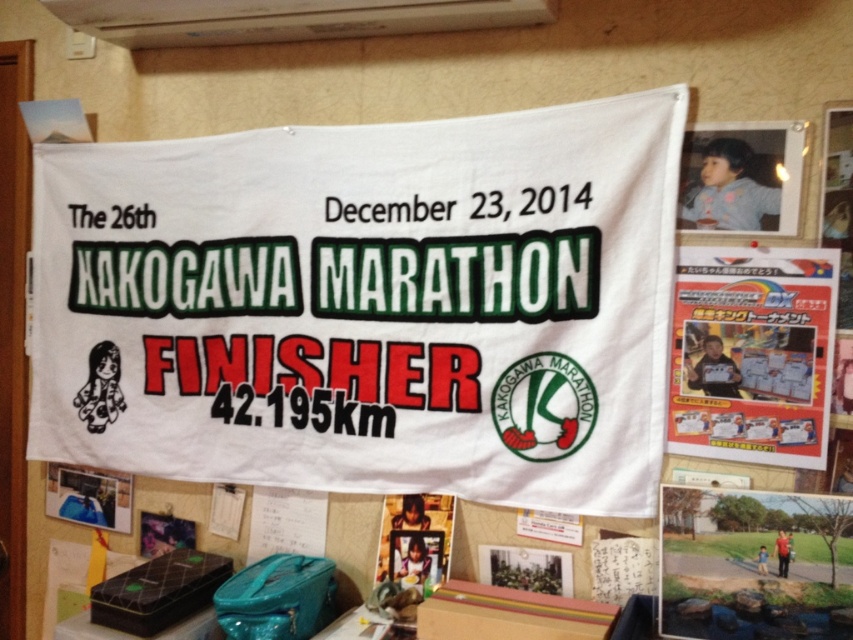
You are standing 5 feet away from the corkboard wall. If you want to reach the white fabric banner at upper center, can you touch it without moving your position?

The white fabric banner at upper center is 4.27 feet away from the camera, so yes, you can touch it without moving since you are standing 5 feet away from the wall. The distance to the banner is within your reach.

You are a photographer who needs to take a photo of the white paper poster at upper right. Your camera is placed on a tripod. The camera has a focal length of 50mm and you want to capture the entire poster in the frame. Given that the poster is 1.34 meters away from the camera, what is the minimum sensor width in millimeters required for your camera to fit the poster horizontally without cropping?

The white paper poster at upper right and camera are 1.34 meters apart from each other. To calculate the minimum sensor width, use the formula sensor width required equals twice the poster width divided by the distance. However, since the poster width is not provided, it is impossible to determine the exact sensor width needed. Please provide the poster width to proceed.

Based on the photo, you are standing in front of a corkboard wall covered with photos and notes. There is a point marked at coordinates [753,564]. What object is located at that point?

The point at coordinates [753,564] indicates the white fabric banner at upper center.